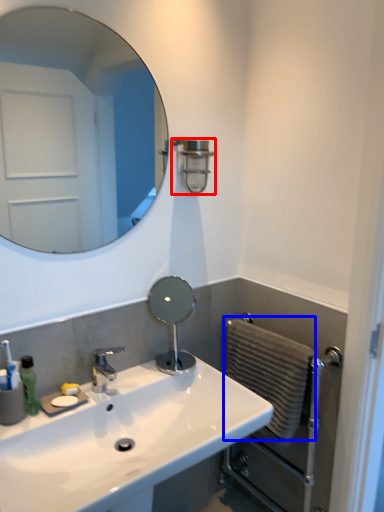
Question: Which object is further to the camera taking this photo, shower (highlighted by a red box) or hand towel (highlighted by a blue box)?

Choices:
 (A) shower
 (B) hand towel

Answer: (A)